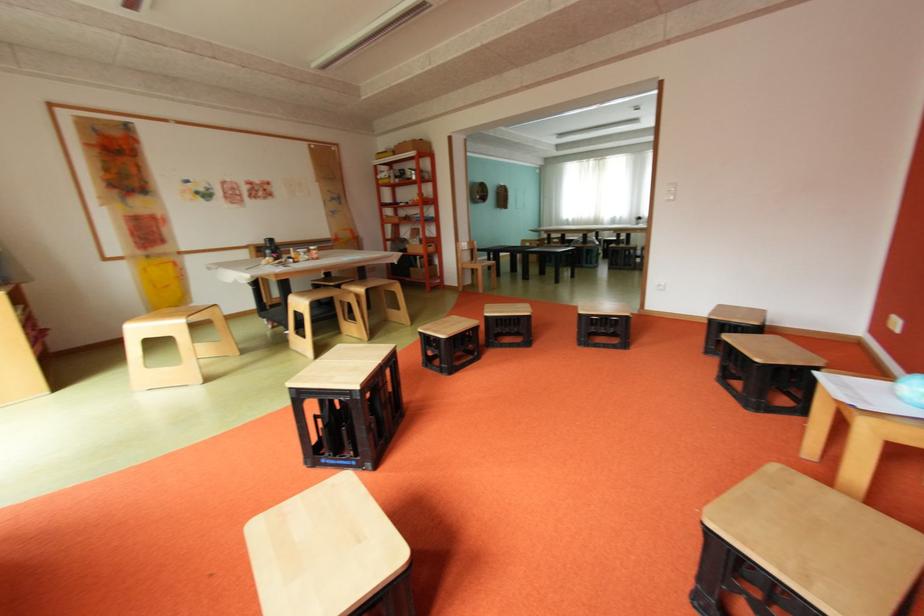
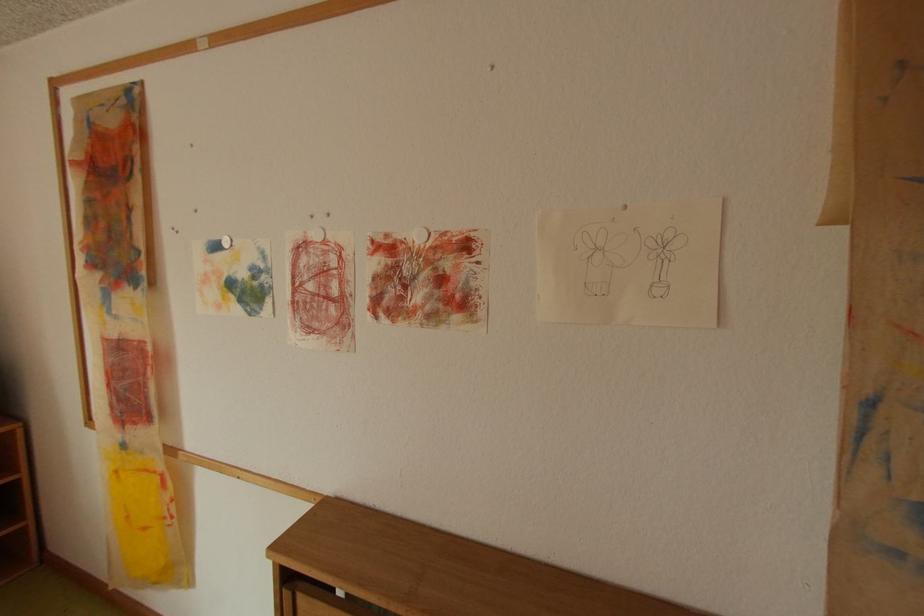
In the second image, find the point that corresponds to point (212, 200) in the first image.

(247, 309)